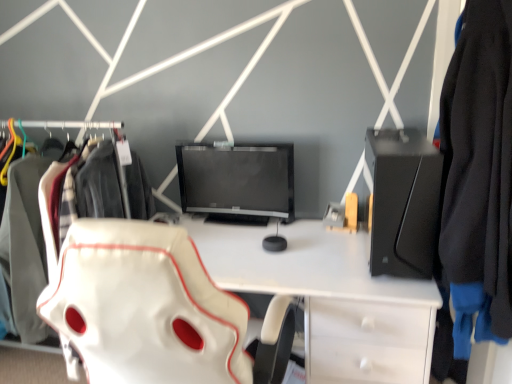
Where is `free space in front of matte black monitor at center`? Image resolution: width=512 pixels, height=384 pixels. free space in front of matte black monitor at center is located at coordinates (256, 250).